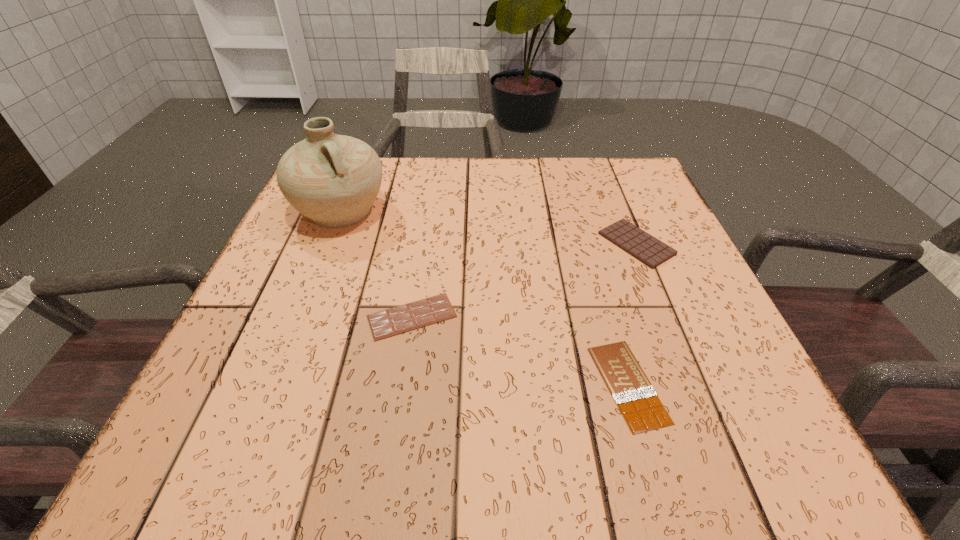
Where is `vacant space at the right edge of the desktop`? vacant space at the right edge of the desktop is located at coordinates (662, 379).

This screenshot has width=960, height=540. I want to click on free space at the far right corner of the desktop, so click(x=644, y=195).

You are a GUI agent. You are given a task and a screenshot of the screen. Output one action in this format:
    pyautogui.click(x=<x>, y=<y>)
    Task: Click on the free space between the nearest object and the tallest chocolate bar
    The image size is (960, 540).
    Given the screenshot: What is the action you would take?
    pyautogui.click(x=633, y=314)

I want to click on empty location between the third shortest object and the second nearest object, so click(x=524, y=280).

This screenshot has height=540, width=960. I want to click on free space between the shortest object and the leftmost object, so click(484, 298).

Locate an element on the screen. The width and height of the screenshot is (960, 540). empty space between the shortest object and the pottery is located at coordinates tap(484, 298).

Locate an element on the screen. The width and height of the screenshot is (960, 540). free space that is in between the leftmost object and the tallest chocolate bar is located at coordinates (489, 227).

You are a GUI agent. You are given a task and a screenshot of the screen. Output one action in this format:
    pyautogui.click(x=<x>, y=<y>)
    Task: Click on the vacant point located between the tallest object and the leftmost chocolate bar
    The height and width of the screenshot is (540, 960).
    Given the screenshot: What is the action you would take?
    pyautogui.click(x=376, y=264)

At what (x,y) coordinates should I click in order to perform the action: click on unoccupied position between the pottery and the second object from left to right. Please return your answer as a coordinate pair (x, y). Looking at the image, I should click on (376, 264).

At what (x,y) coordinates should I click in order to perform the action: click on free area in between the tallest object and the shortest object. Please return your answer as a coordinate pair (x, y). The width and height of the screenshot is (960, 540). Looking at the image, I should click on (484, 298).